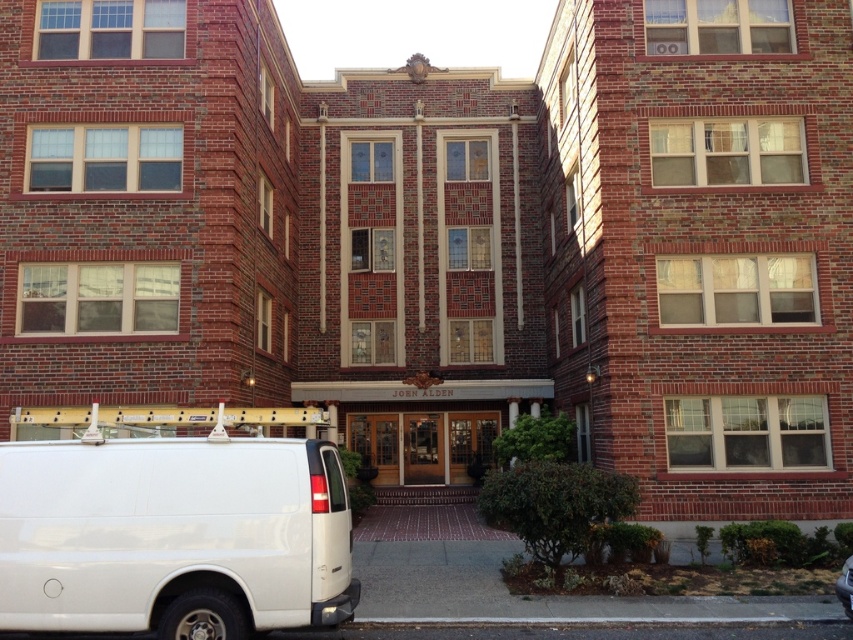
You are a delivery person who needs to park your white matte van at lower left near the entrance of the JOHN ALDEN building. The shiny black car at lower right is already parked there. Based on the scene, can you park your van without moving the car?

The white matte van at lower left is located above the shiny black car at lower right, meaning it is parked in a higher position. Since the van is already positioned above the car, you can likely park your van without needing to move the car as they are at different levels.

You are a delivery driver who needs to park your vehicle in front of the brick building. You have a white matte van at lower left and a shiny black car at lower right. Which vehicle will require more space to park properly?

The white matte van at lower left will require more space to park properly because its width is larger than the shiny black car at lower right.

You are a delivery driver who needs to park your vehicle in the parking lot behind the brick building. The parking spot is only 1.8 meters tall. You have a white matte van at lower left and a shiny black car at lower right. Which vehicle can fit into the parking spot based on their height?

The white matte van at lower left is taller than the shiny black car at lower right. Since the parking spot is only 1.8 meters tall, the shiny black car at lower right can fit, but the white matte van at lower left might be too tall.